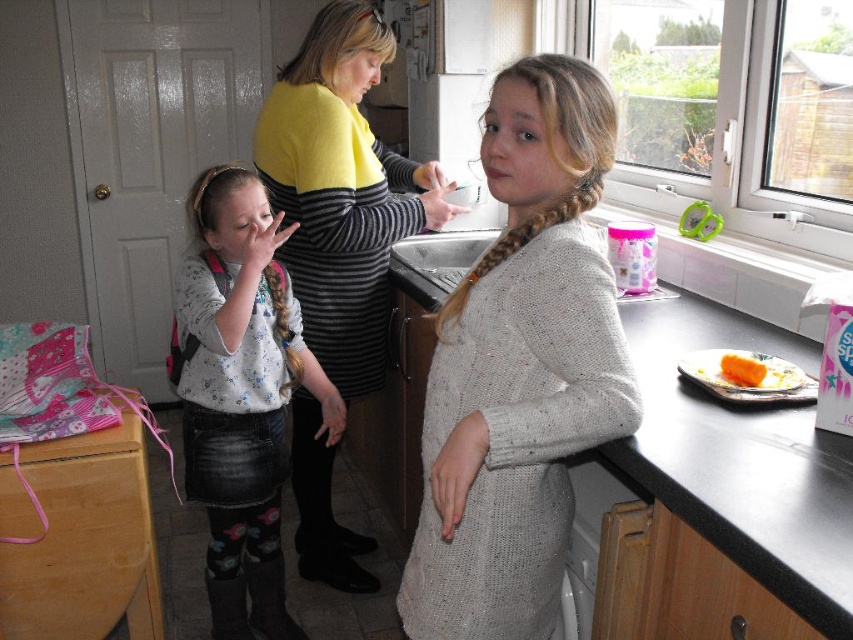
You are a photographer standing in the kitchen and want to take a photo of the yellow sweater at center and the black laminate counter at center. Which object is closer to you?

The yellow sweater at center is closer to you because it is further to the viewer than the black laminate counter at center.

You are standing in the kitchen scene and want to reach a specific point marked at coordinates point (x=281, y=186). If you are 1.6 meters tall, can you comfortably reach this point without stretching?

The distance of point (x=281, y=186) from viewer is 1.88 meters. Since the point is 1.88 meters away from you and your height is 1.6 meters, you would need to stretch or stand on something to reach it comfortably.

You are a delivery person standing at the entrance of the kitchen. You need to place a package on the black laminate counter at center. The package requires a minimum of 36 inches of space to be placed safely. Can you determine if the counter is within reach?

The black laminate counter at center is 30.59 inches away from viewer, which is less than the required 36 inches. Therefore, the counter is within reach and the package can be safely placed there.